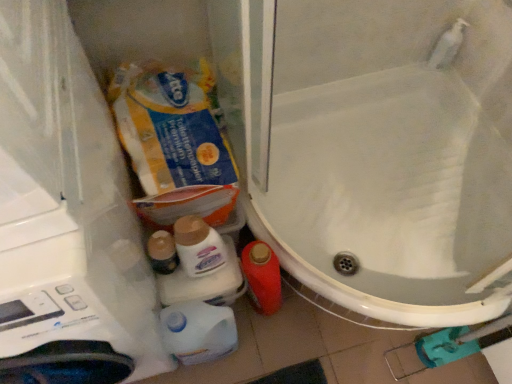
Describe the element at coordinates (170, 125) in the screenshot. I see `yellow cardboard toilet paper at upper left` at that location.

Measure the distance between point (419, 251) and camera.

Point (419, 251) and camera are 4.37 feet apart from each other.

This screenshot has height=384, width=512. What do you see at coordinates (198, 246) in the screenshot? I see `matte plastic bottle at lower center, the second cleaning product positioned from the bottom` at bounding box center [198, 246].

Image resolution: width=512 pixels, height=384 pixels. What are the coordinates of `matte plastic toiletries at center` in the screenshot? It's located at (162, 252).

The width and height of the screenshot is (512, 384). What are the coordinates of `yellow cardboard toilet paper at upper left` in the screenshot? It's located at (x=170, y=125).

Who is bigger, white glossy toilet at lower left or yellow cardboard toilet paper at upper left?

With larger size is white glossy toilet at lower left.

How much distance is there between white glossy toilet at lower left and yellow cardboard toilet paper at upper left?

The distance of white glossy toilet at lower left from yellow cardboard toilet paper at upper left is 18.31 inches.

Does white glossy toilet at lower left contain yellow cardboard toilet paper at upper left?

No, yellow cardboard toilet paper at upper left is not a part of white glossy toilet at lower left.

Is white glossy toilet at lower left facing away from yellow cardboard toilet paper at upper left?

No.

Based on the photo, is matte plastic bottle at lower center, the second cleaning product positioned from the bottom, at the right side of matte plastic toiletries at center?

Correct, you'll find matte plastic bottle at lower center, the second cleaning product positioned from the bottom, to the right of matte plastic toiletries at center.

Is matte plastic bottle at lower center, which is the 1th cleaning product in top-to-bottom order, surrounding matte plastic toiletries at center?

That's incorrect, matte plastic toiletries at center is not inside matte plastic bottle at lower center, which is the 1th cleaning product in top-to-bottom order.

Is matte plastic bottle at lower center, which is the 1th cleaning product in top-to-bottom order, wider or thinner than matte plastic toiletries at center?

Clearly, matte plastic bottle at lower center, which is the 1th cleaning product in top-to-bottom order, has less width compared to matte plastic toiletries at center.

Which of these two, matte plastic bottle at lower center, the second cleaning product positioned from the bottom, or matte plastic toiletries at center, is smaller?

With smaller size is matte plastic toiletries at center.

Where is `product on the left of the white glossy toilet at lower left`? product on the left of the white glossy toilet at lower left is located at coordinates (170, 125).

Who is smaller, yellow cardboard toilet paper at upper left or white glossy toilet at lower left?

With smaller size is yellow cardboard toilet paper at upper left.

Would you say yellow cardboard toilet paper at upper left is to the left or to the right of white glossy toilet at lower left in the picture?

Clearly, yellow cardboard toilet paper at upper left is on the left of white glossy toilet at lower left in the image.

Which is farther, (197, 177) or (444, 228)?

The point (444, 228) is behind.

Which is nearer, (x=218, y=331) or (x=465, y=100)?

The point (x=218, y=331) is more forward.

Could you measure the distance between white glossy bottle at lower center, which ranks as the second cleaning product in top-to-bottom order, and white glossy toilet at lower left?

The distance of white glossy bottle at lower center, which ranks as the second cleaning product in top-to-bottom order, from white glossy toilet at lower left is 60.24 centimeters.

From their relative heights in the image, would you say white glossy bottle at lower center, which ranks as the second cleaning product in top-to-bottom order, is taller or shorter than white glossy toilet at lower left?

Clearly, white glossy bottle at lower center, which ranks as the second cleaning product in top-to-bottom order, is taller compared to white glossy toilet at lower left.

Would you consider white glossy bottle at lower center, which appears as the first cleaning product when ordered from the bottom, to be distant from white glossy toilet at lower left?

No, white glossy bottle at lower center, which appears as the first cleaning product when ordered from the bottom, is in close proximity to white glossy toilet at lower left.

From the image's perspective, is matte plastic bottle at lower center, the second cleaning product positioned from the bottom, above yellow cardboard toilet paper at upper left?

No, from the image's perspective, matte plastic bottle at lower center, the second cleaning product positioned from the bottom, is not over yellow cardboard toilet paper at upper left.

Based on the photo, is matte plastic bottle at lower center, the second cleaning product positioned from the bottom, aimed at yellow cardboard toilet paper at upper left?

No, matte plastic bottle at lower center, the second cleaning product positioned from the bottom, is not facing towards yellow cardboard toilet paper at upper left.

Can you confirm if matte plastic bottle at lower center, which is the 1th cleaning product in top-to-bottom order, is smaller than yellow cardboard toilet paper at upper left?

Correct, matte plastic bottle at lower center, which is the 1th cleaning product in top-to-bottom order, occupies less space than yellow cardboard toilet paper at upper left.

Does point (178, 222) lie in front of point (184, 180)?

Yes.

Is matte plastic bottle at lower center, which is the 1th cleaning product in top-to-bottom order, aimed at white glossy toilet at lower left?

No, matte plastic bottle at lower center, which is the 1th cleaning product in top-to-bottom order, is not oriented towards white glossy toilet at lower left.

Locate an element on the screen. toilet lying on the right of matte plastic bottle at lower center, which is the 1th cleaning product in top-to-bottom order is located at coordinates (389, 195).

Is matte plastic bottle at lower center, which is the 1th cleaning product in top-to-bottom order, not close to white glossy toilet at lower left?

matte plastic bottle at lower center, which is the 1th cleaning product in top-to-bottom order, is near white glossy toilet at lower left, not far away.

From the image's perspective, which is above, matte plastic bottle at lower center, which is the 1th cleaning product in top-to-bottom order, or white glossy toilet at lower left?

white glossy toilet at lower left, from the image's perspective.

Does matte plastic toiletries at center have a smaller size compared to white glossy bottle at lower center, which appears as the first cleaning product when ordered from the bottom?

Correct, matte plastic toiletries at center occupies less space than white glossy bottle at lower center, which appears as the first cleaning product when ordered from the bottom.

Which is in front, matte plastic toiletries at center or white glossy bottle at lower center, which appears as the first cleaning product when ordered from the bottom?

white glossy bottle at lower center, which appears as the first cleaning product when ordered from the bottom, is in front.

Is matte plastic toiletries at center positioned far away from white glossy bottle at lower center, which appears as the first cleaning product when ordered from the bottom?

No, matte plastic toiletries at center is not far away from white glossy bottle at lower center, which appears as the first cleaning product when ordered from the bottom.

Considering the positions of points (147, 254) and (191, 320), is point (147, 254) closer to camera compared to point (191, 320)?

No.

Image resolution: width=512 pixels, height=384 pixels. Identify the location of product in front of the white glossy toilet at lower left. (170, 125).

What are the coordinates of `cleaning product positioned vertically above the matte plastic toiletries at center (from a real-world perspective)` in the screenshot? It's located at (198, 246).

From the image, which object appears to be nearer to yellow cardboard toilet paper at upper left, matte plastic toiletries at center or matte plastic bottle at lower center, which is the 1th cleaning product in top-to-bottom order?

matte plastic bottle at lower center, which is the 1th cleaning product in top-to-bottom order.

Considering their positions, is matte plastic toiletries at center positioned further to matte plastic bottle at lower center, the second cleaning product positioned from the bottom, than yellow cardboard toilet paper at upper left?

The object further to matte plastic bottle at lower center, the second cleaning product positioned from the bottom, is yellow cardboard toilet paper at upper left.

Estimate the real-world distances between objects in this image. Which object is further from white glossy bottle at lower center, which ranks as the second cleaning product in top-to-bottom order, yellow cardboard toilet paper at upper left or white glossy toilet at lower left?

white glossy toilet at lower left.

Looking at the image, which one is located further to white glossy toilet at lower left, yellow cardboard toilet paper at upper left or white glossy bottle at lower center, which appears as the first cleaning product when ordered from the bottom?

white glossy bottle at lower center, which appears as the first cleaning product when ordered from the bottom.

Considering their positions, is matte plastic toiletries at center positioned further to white glossy bottle at lower center, which ranks as the second cleaning product in top-to-bottom order, than white glossy toilet at lower left?

white glossy toilet at lower left lies further to white glossy bottle at lower center, which ranks as the second cleaning product in top-to-bottom order, than the other object.

In the scene shown: Estimate the real-world distances between objects in this image. Which object is further from white glossy toilet at lower left, matte plastic bottle at lower center, which is the 1th cleaning product in top-to-bottom order, or yellow cardboard toilet paper at upper left?

matte plastic bottle at lower center, which is the 1th cleaning product in top-to-bottom order, lies further to white glossy toilet at lower left than the other object.

Looking at the image, which one is located closer to yellow cardboard toilet paper at upper left, white glossy bottle at lower center, which appears as the first cleaning product when ordered from the bottom, or matte plastic bottle at lower center, the second cleaning product positioned from the bottom?

Among the two, matte plastic bottle at lower center, the second cleaning product positioned from the bottom, is located nearer to yellow cardboard toilet paper at upper left.

From the image, which object appears to be farther from matte plastic bottle at lower center, which is the 1th cleaning product in top-to-bottom order, yellow cardboard toilet paper at upper left or matte plastic toiletries at center?

Among the two, yellow cardboard toilet paper at upper left is located further to matte plastic bottle at lower center, which is the 1th cleaning product in top-to-bottom order.

You are a GUI agent. You are given a task and a screenshot of the screen. Output one action in this format:
    pyautogui.click(x=<x>, y=<y>)
    Task: Click on the cleaning product located between white glossy bottle at lower center, which ranks as the second cleaning product in top-to-bottom order, and white glossy toilet at lower left in the left-right direction
    
    Given the screenshot: What is the action you would take?
    pyautogui.click(x=198, y=246)

Find the location of `toiletry between yellow cardboard toilet paper at upper left and white glossy bottle at lower center, which ranks as the second cleaning product in top-to-bottom order, from top to bottom`. toiletry between yellow cardboard toilet paper at upper left and white glossy bottle at lower center, which ranks as the second cleaning product in top-to-bottom order, from top to bottom is located at coordinates (162, 252).

Locate an element on the screen. product between matte plastic toiletries at center and white glossy toilet at lower left from left to right is located at coordinates (170, 125).

Identify the location of toiletry that lies between matte plastic bottle at lower center, the second cleaning product positioned from the bottom, and white glossy bottle at lower center, which ranks as the second cleaning product in top-to-bottom order, from top to bottom. This screenshot has height=384, width=512. (162, 252).